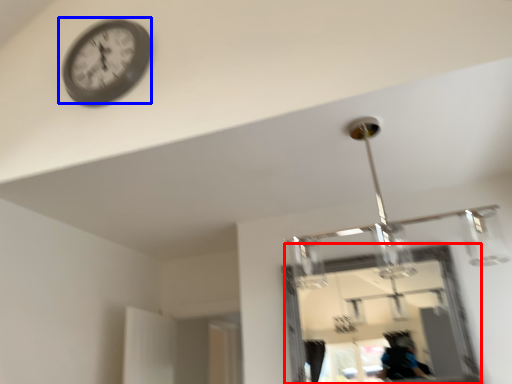
Question: Which of the following is the closest to the observer, mirror (highlighted by a red box) or wall clock (highlighted by a blue box)?

Choices:
 (A) mirror
 (B) wall clock

Answer: (B)